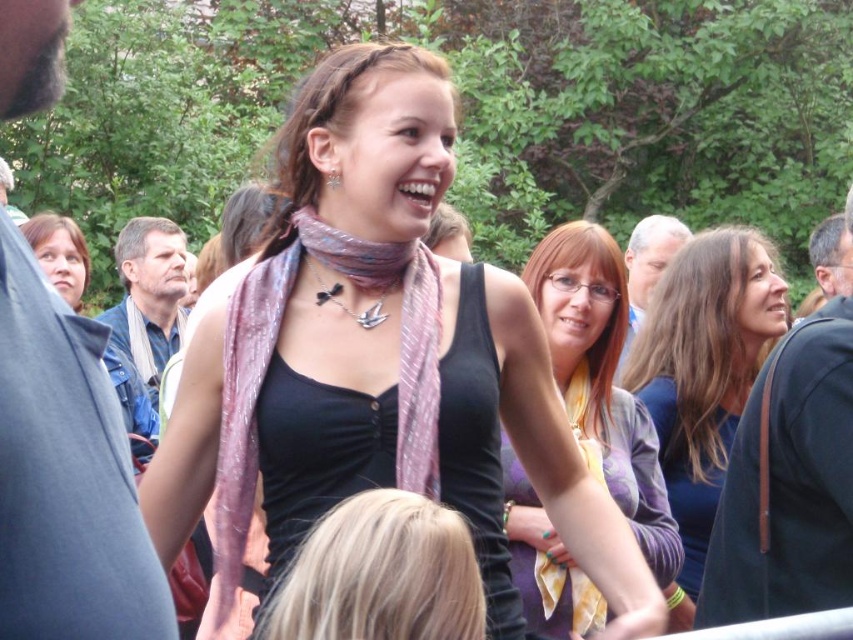
You are attending an outdoor event and want to locate two specific attendees wearing a dark blue shirt at right and a purple satin dress at upper right. Which one is positioned to the right of the other?

The dark blue shirt at right is positioned on the right side of purple satin dress at upper right.

You are at an outdoor event and want to take a photo of the dark blue shirt at right and the purple satin dress at upper right. Which one should you focus on first to ensure both are in focus?

You should focus on the dark blue shirt at right first because it is closer to the viewer than the purple satin dress at upper right, so adjusting focus from near to far will help both be in focus.